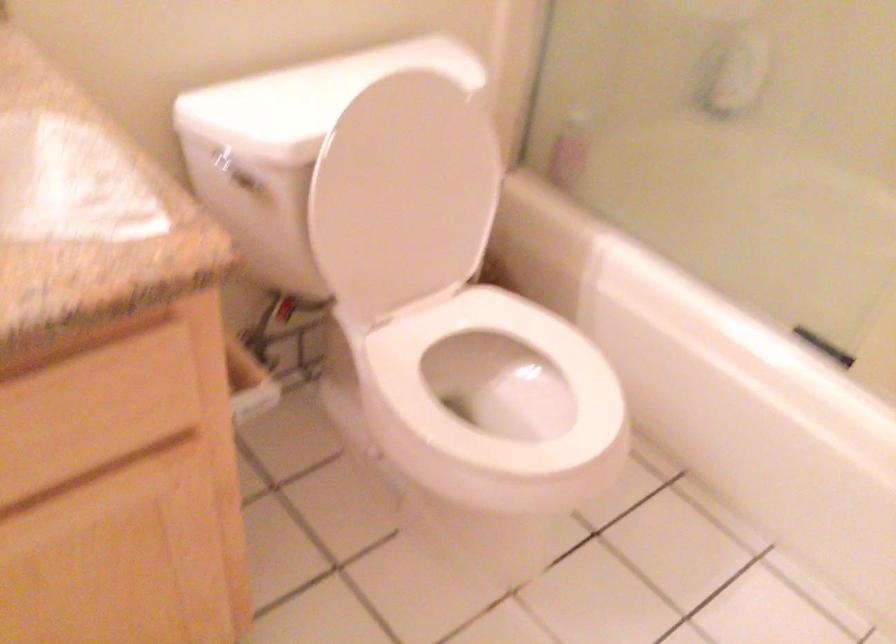
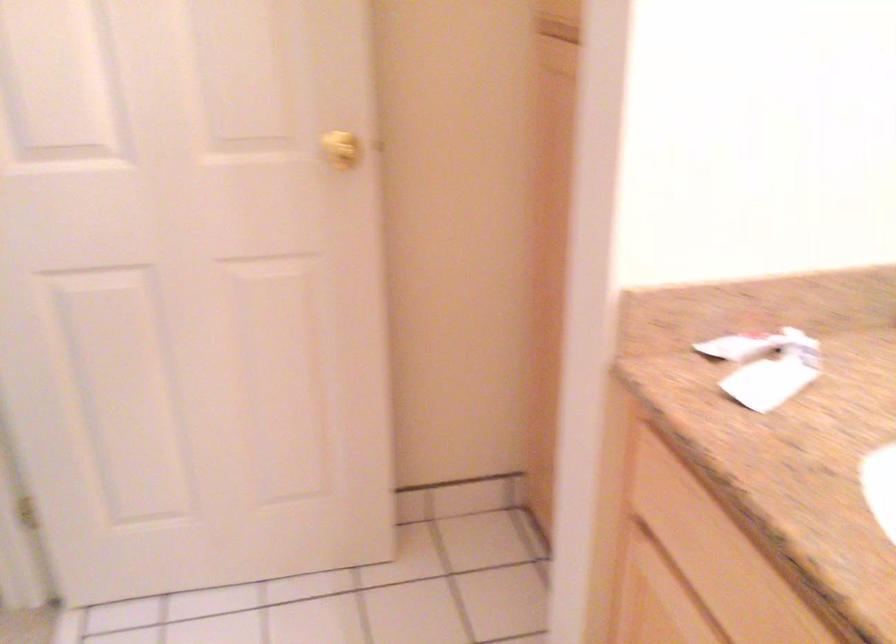
How did the camera likely rotate?

The rotation direction of the camera is left-down.